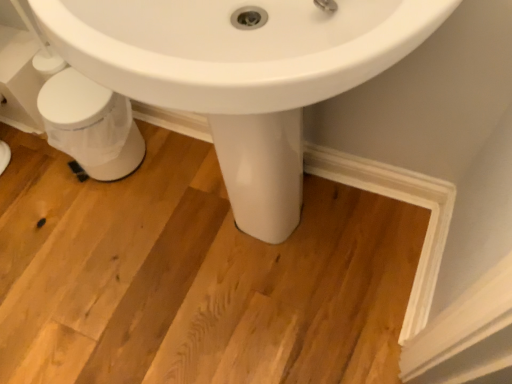
Question: Is white glossy sink at center in front of or behind white plastic trash can at lower left in the image?

Choices:
 (A) behind
 (B) front

Answer: (B)

Question: From a real-world perspective, is white glossy sink at center above or below white plastic trash can at lower left?

Choices:
 (A) below
 (B) above

Answer: (B)

Question: In the image, is white glossy sink at center on the left side or the right side of white plastic trash can at lower left?

Choices:
 (A) right
 (B) left

Answer: (A)

Question: Is point (122, 160) closer or farther from the camera than point (134, 92)?

Choices:
 (A) farther
 (B) closer

Answer: (A)

Question: In the image, is white plastic trash can at lower left positioned in front of or behind white glossy sink at center?

Choices:
 (A) front
 (B) behind

Answer: (B)

Question: From a real-world perspective, is white plastic trash can at lower left positioned above or below white glossy sink at center?

Choices:
 (A) below
 (B) above

Answer: (A)

Question: From the image's perspective, is white plastic trash can at lower left located above or below white glossy sink at center?

Choices:
 (A) above
 (B) below

Answer: (A)